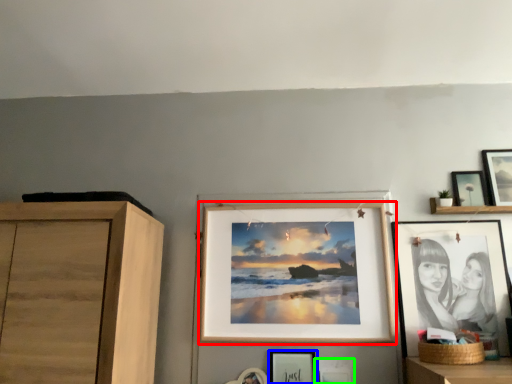
Question: Based on their relative distances, which object is farther from picture frame (highlighted by a red box)? Choose from picture frame (highlighted by a blue box) and picture frame (highlighted by a green box).

Choices:
 (A) picture frame
 (B) picture frame

Answer: (B)